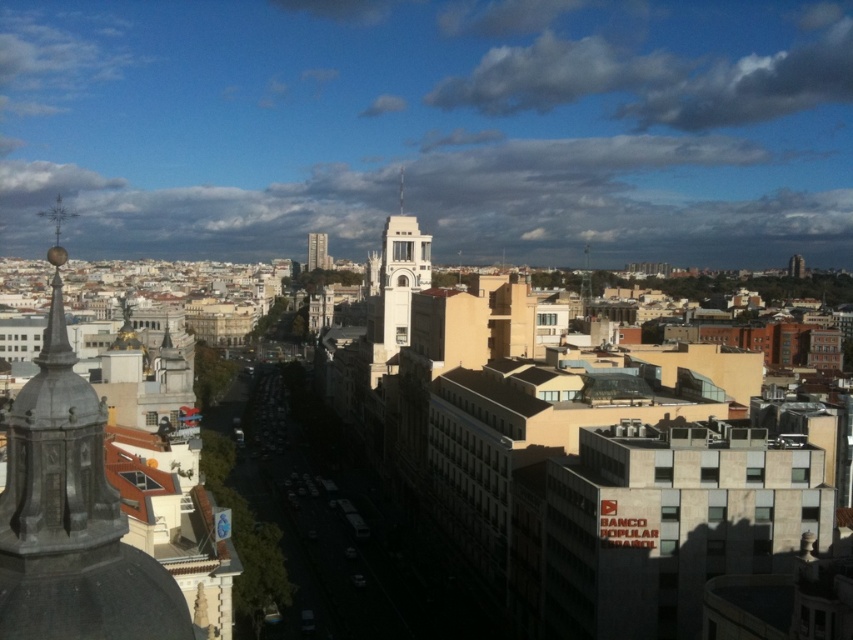
Question: Among these points, which one is nearest to the camera?

Choices:
 (A) (314, 259)
 (B) (384, 326)
 (C) (401, 196)

Answer: (B)

Question: Is smooth glass skyscraper at center bigger than silver metallic spire at center?

Choices:
 (A) yes
 (B) no

Answer: (A)

Question: From the image, what is the correct spatial relationship of white concrete tower at center in relation to smooth glass skyscraper at center?

Choices:
 (A) right
 (B) left

Answer: (A)

Question: Which of these objects is positioned farthest from the silver metallic spire at center?

Choices:
 (A) smooth glass skyscraper at center
 (B) white concrete tower at center

Answer: (B)

Question: Which is farther from the silver metallic spire at center?

Choices:
 (A) smooth glass skyscraper at center
 (B) white concrete tower at center

Answer: (B)

Question: Does smooth glass skyscraper at center have a lesser width compared to silver metallic spire at center?

Choices:
 (A) yes
 (B) no

Answer: (B)